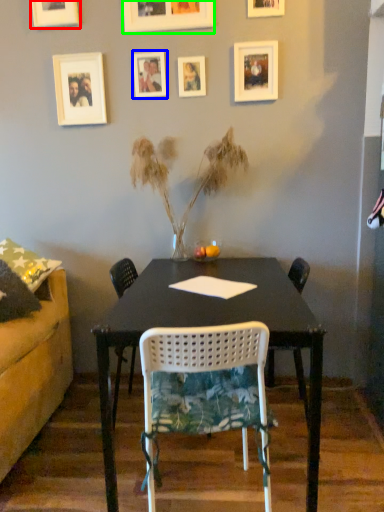
Question: Which object is the farthest from picture frame (highlighted by a red box)? Choose among these: picture frame (highlighted by a blue box) or picture frame (highlighted by a green box).

Choices:
 (A) picture frame
 (B) picture frame

Answer: (A)